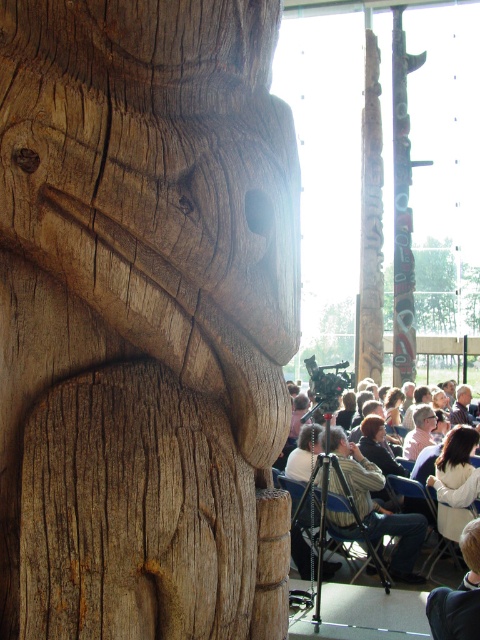
Consider the image. You are an event organizer setting up a photo shoot for the carved wood totem pole at center and the matte wooden crowd at center. Which object should you focus your camera on first if you want to capture both in a single frame without moving the camera?

You should focus on the carved wood totem pole at center first because it occupies less space than the matte wooden crowd at center, allowing you to frame it while still including the larger crowd in the background.

You are standing in the room and want to sit down. The light brown wood chair at center is at point 0.794, 0.792. Is the chair located closer to the front or the back of the room?

The light brown wood chair at center is located at point [380,508], which places it closer to the back of the room since the coordinates are closer to the upper right corner, typically representing the back in such coordinate systems.